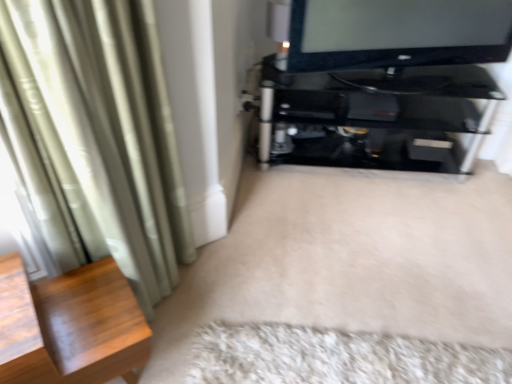
Find the location of a particular element. empty space that is ontop of white fluffy rug at lower center (from a real-world perspective) is located at coordinates (297, 353).